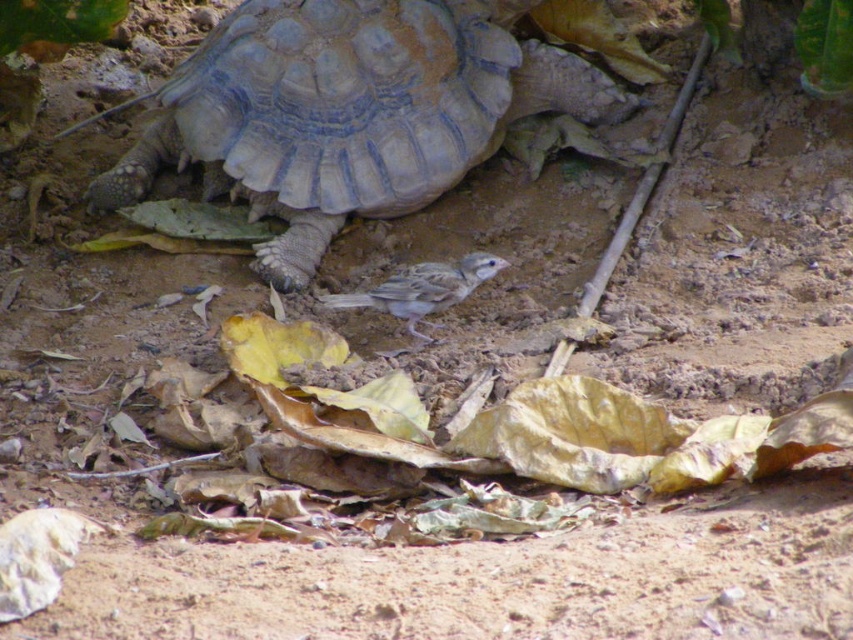
Question: Is gray textured shell at center thinner than gray matte bird at center?

Choices:
 (A) yes
 (B) no

Answer: (B)

Question: Which point appears closest to the camera in this image?

Choices:
 (A) tap(279, 168)
 (B) tap(471, 276)

Answer: (B)

Question: Is gray textured shell at center above gray matte bird at center?

Choices:
 (A) yes
 (B) no

Answer: (A)

Question: Is gray textured shell at center positioned in front of gray matte bird at center?

Choices:
 (A) no
 (B) yes

Answer: (A)

Question: Which object is farther from the camera taking this photo?

Choices:
 (A) gray textured shell at center
 (B) gray matte bird at center

Answer: (A)